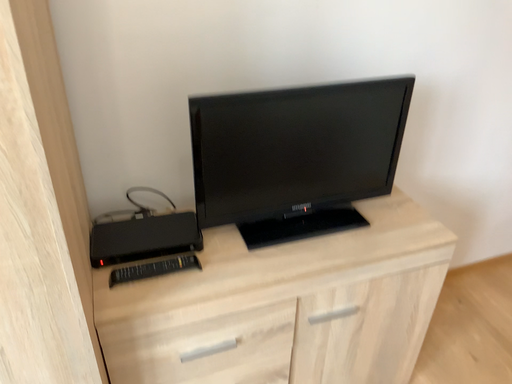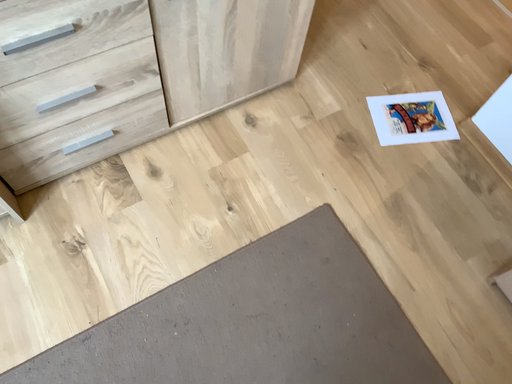
Question: How did the camera likely rotate when shooting the video?

Choices:
 (A) rotated right
 (B) rotated left

Answer: (A)